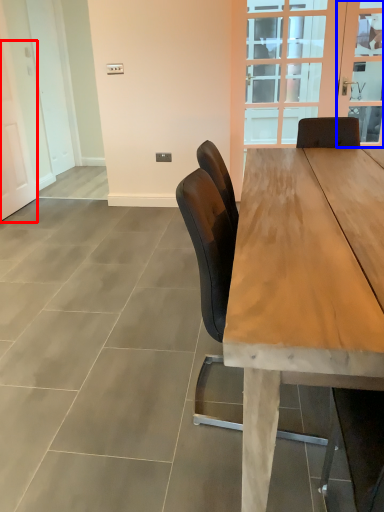
Question: Which of the following is the closest to the observer, screen door (highlighted by a red box) or window screen (highlighted by a blue box)?

Choices:
 (A) screen door
 (B) window screen

Answer: (A)